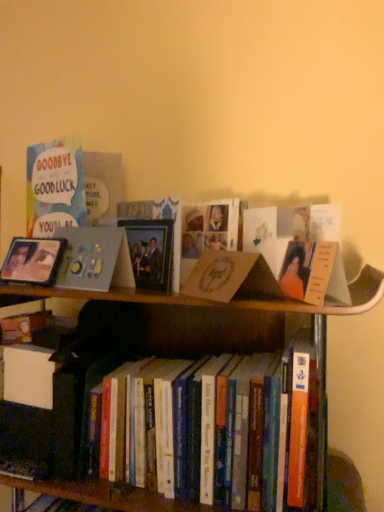
Where is `hardcover books at center`? This screenshot has width=384, height=512. hardcover books at center is located at coordinates (213, 426).

Which object is thinner, brown cardboard book at center or matte silver picture frame at left?

Thinner between the two is matte silver picture frame at left.

Which of these two, brown cardboard book at center or matte silver picture frame at left, stands taller?

matte silver picture frame at left is taller.

Is brown cardboard book at center bigger than matte silver picture frame at left?

Indeed, brown cardboard book at center has a larger size compared to matte silver picture frame at left.

Is the depth of brown cardboard book at center less than that of matte silver picture frame at left?

Yes, the depth of brown cardboard book at center is less than that of matte silver picture frame at left.

Considering the sizes of hardcover books at center and matte silver picture frame at left in the image, is hardcover books at center taller or shorter than matte silver picture frame at left?

Considering their sizes, hardcover books at center has more height than matte silver picture frame at left.

Considering the relative sizes of hardcover books at center and matte silver picture frame at left in the image provided, is hardcover books at center thinner than matte silver picture frame at left?

In fact, hardcover books at center might be wider than matte silver picture frame at left.

From the image's perspective, relative to matte silver picture frame at left, is hardcover books at center above or below?

hardcover books at center is below matte silver picture frame at left.

Is there a large distance between hardcover books at center and matte silver picture frame at left?

No, hardcover books at center is not far away from matte silver picture frame at left.

From a real-world perspective, between hardcover books at center and brown cardboard book at center, who is vertically higher?

In real-world perspective, brown cardboard book at center is above.

From the picture: Could you tell me if hardcover books at center is turned towards brown cardboard book at center?

No, hardcover books at center is not aimed at brown cardboard book at center.

Can you confirm if hardcover books at center is taller than brown cardboard book at center?

Correct, hardcover books at center is much taller as brown cardboard book at center.

Which is more to the right, matte gray photo frame at upper left or hardcover books at center?

hardcover books at center is more to the right.

From a real-world perspective, is matte gray photo frame at upper left on hardcover books at center?

Yes, from a real-world perspective, matte gray photo frame at upper left is above hardcover books at center.

Is matte gray photo frame at upper left oriented away from hardcover books at center?

No, matte gray photo frame at upper left is not facing away from hardcover books at center.

In terms of height, does matte gray photo frame at upper left look taller or shorter compared to hardcover books at center?

matte gray photo frame at upper left is shorter than hardcover books at center.

Does point (30, 253) appear closer or farther from the camera than point (297, 450)?

Point (30, 253) is farther from the camera than point (297, 450).

Looking at this image, in terms of size, does matte silver picture frame at left appear bigger or smaller than hardcover books at center?

Considering their sizes, matte silver picture frame at left takes up less space than hardcover books at center.

From the image's perspective, which object appears higher, matte silver picture frame at left or hardcover books at center?

matte silver picture frame at left, from the image's perspective.

Can you confirm if matte gray photo frame at upper left is thinner than matte silver picture frame at left?

Correct, the width of matte gray photo frame at upper left is less than that of matte silver picture frame at left.

Does matte gray photo frame at upper left turn towards matte silver picture frame at left?

No, matte gray photo frame at upper left is not turned towards matte silver picture frame at left.

Locate an element on the screen. The width and height of the screenshot is (384, 512). picture frame that appears behind the matte gray photo frame at upper left is located at coordinates (32, 261).

Considering the sizes of matte gray photo frame at upper left and matte silver picture frame at left in the image, is matte gray photo frame at upper left bigger or smaller than matte silver picture frame at left?

Clearly, matte gray photo frame at upper left is larger in size than matte silver picture frame at left.

Considering the relative sizes of matte gray photo frame at upper left and brown cardboard book at center in the image provided, is matte gray photo frame at upper left bigger than brown cardboard book at center?

Yes, matte gray photo frame at upper left is bigger than brown cardboard book at center.

Does matte gray photo frame at upper left appear on the right side of brown cardboard book at center?

In fact, matte gray photo frame at upper left is to the left of brown cardboard book at center.

How different are the orientations of matte gray photo frame at upper left and brown cardboard book at center in degrees?

25.4 degrees.

Does point (98, 283) come in front of point (217, 256)?

No, (98, 283) is behind (217, 256).

Find the location of a particular element. Image resolution: width=384 pixels, height=512 pixels. paperback book below the matte silver picture frame at left (from the image's perspective) is located at coordinates (219, 275).

Identify the location of picture frame above the hardcover books at center (from the image's perspective). (32, 261).

When comparing their distances from brown cardboard book at center, does matte gray photo frame at upper left or hardcover books at center seem closer?

matte gray photo frame at upper left is closer to brown cardboard book at center.

Based on their spatial positions, is matte gray photo frame at upper left or matte silver picture frame at left closer to hardcover books at center?

Among the two, matte gray photo frame at upper left is located nearer to hardcover books at center.

From the image, which object appears to be nearer to matte gray photo frame at upper left, hardcover books at center or brown cardboard book at center?

brown cardboard book at center.

Estimate the real-world distances between objects in this image. Which object is closer to brown cardboard book at center, matte silver picture frame at left or hardcover books at center?

hardcover books at center lies closer to brown cardboard book at center than the other object.

Which object lies further to the anchor point matte silver picture frame at left, hardcover books at center or matte gray photo frame at upper left?

Based on the image, hardcover books at center appears to be further to matte silver picture frame at left.

Consider the image. Estimate the real-world distances between objects in this image. Which object is further from hardcover books at center, matte silver picture frame at left or brown cardboard book at center?

The object further to hardcover books at center is matte silver picture frame at left.

Considering their positions, is matte silver picture frame at left positioned closer to matte gray photo frame at upper left than hardcover books at center?

The object closer to matte gray photo frame at upper left is matte silver picture frame at left.

Which object lies nearer to the anchor point matte gray photo frame at upper left, matte silver picture frame at left or brown cardboard book at center?

Among the two, matte silver picture frame at left is located nearer to matte gray photo frame at upper left.

The width and height of the screenshot is (384, 512). In order to click on picture frame between matte gray photo frame at upper left and hardcover books at center in the up-down direction in this screenshot , I will do `click(32, 261)`.

Find the location of a particular element. The height and width of the screenshot is (512, 384). book located between matte silver picture frame at left and brown cardboard book at center in the left-right direction is located at coordinates (213, 426).

Image resolution: width=384 pixels, height=512 pixels. Identify the location of paperback book that lies between matte gray photo frame at upper left and hardcover books at center from top to bottom. (219, 275).

At what (x,y) coordinates should I click in order to perform the action: click on book cover between matte silver picture frame at left and brown cardboard book at center. Please return your answer as a coordinate pair (x, y). Image resolution: width=384 pixels, height=512 pixels. Looking at the image, I should click on (91, 258).